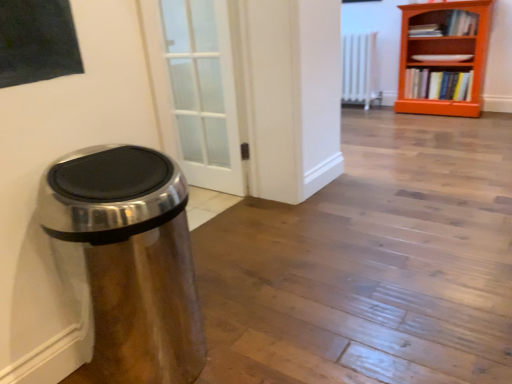
Locate an element on the screen. Image resolution: width=512 pixels, height=384 pixels. free space in front of orange wooden bookcase at upper right is located at coordinates (451, 127).